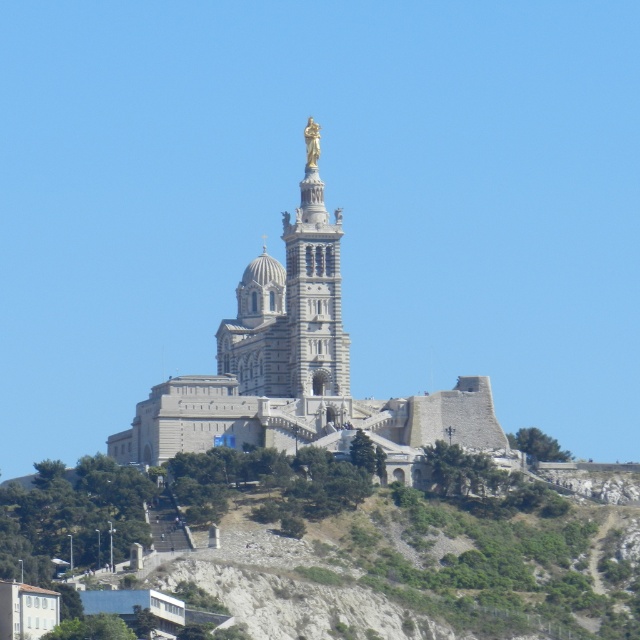
Question: Is beige stone church at center positioned in front of gold metallic statue at center?

Choices:
 (A) yes
 (B) no

Answer: (A)

Question: Considering the relative positions of gold metallic statue at center and gold polished statue at upper center in the image provided, where is gold metallic statue at center located with respect to gold polished statue at upper center?

Choices:
 (A) left
 (B) right

Answer: (B)

Question: Which object is closer to the camera taking this photo?

Choices:
 (A) gold polished statue at upper center
 (B) beige stone church at center
 (C) gold metallic statue at center

Answer: (B)

Question: Is beige stone church at center to the right of gold polished statue at upper center from the viewer's perspective?

Choices:
 (A) yes
 (B) no

Answer: (B)

Question: Which point is closer to the camera?

Choices:
 (A) gold metallic statue at center
 (B) gold polished statue at upper center
 (C) beige stone church at center

Answer: (C)

Question: Which object is farther from the camera taking this photo?

Choices:
 (A) gold polished statue at upper center
 (B) beige stone church at center

Answer: (A)